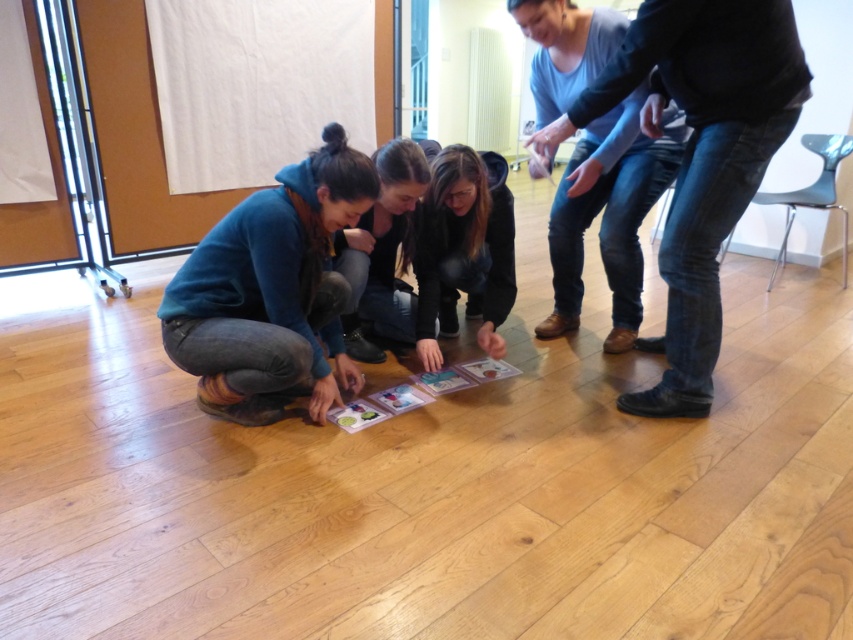
Question: Which of the following is the farthest from the observer?

Choices:
 (A) denim jeans at lower left
 (B) matte black hoodie at center

Answer: (B)

Question: Is matte black hoodie at center above black fabric jacket at center?

Choices:
 (A) no
 (B) yes

Answer: (B)

Question: Which point is closer to the camera?

Choices:
 (A) coord(206,333)
 (B) coord(358,422)

Answer: (A)

Question: Estimate the real-world distances between objects in this image. Which object is closer to the jeans at center?

Choices:
 (A) black fabric jacket at center
 (B) denim jeans at lower left
 (C) matte black hoodie at center

Answer: (C)

Question: In this image, where is matte black hoodie at center located relative to black fabric jacket at center?

Choices:
 (A) right
 (B) left

Answer: (A)

Question: Does denim jeans at lower left have a lesser width compared to translucent plastic cards at center?

Choices:
 (A) yes
 (B) no

Answer: (A)